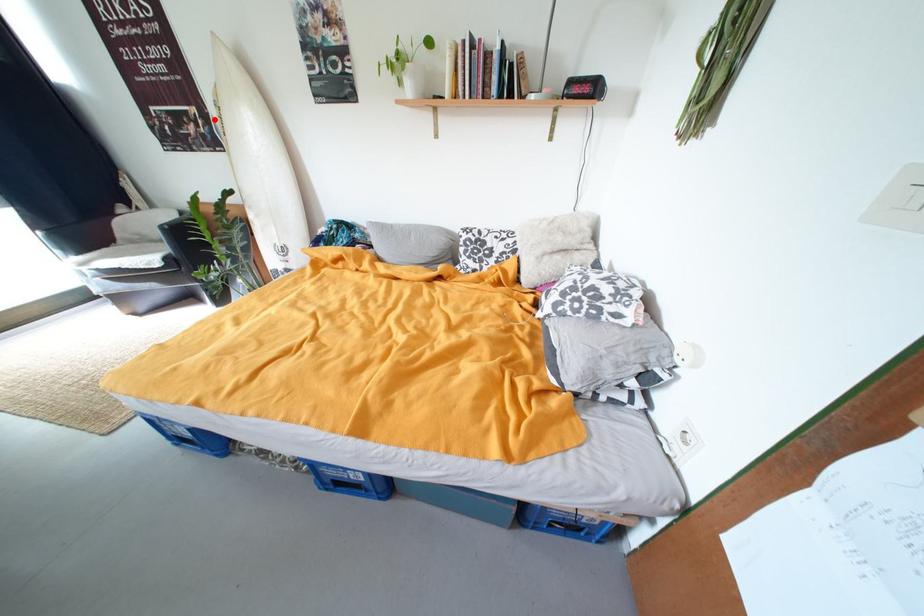
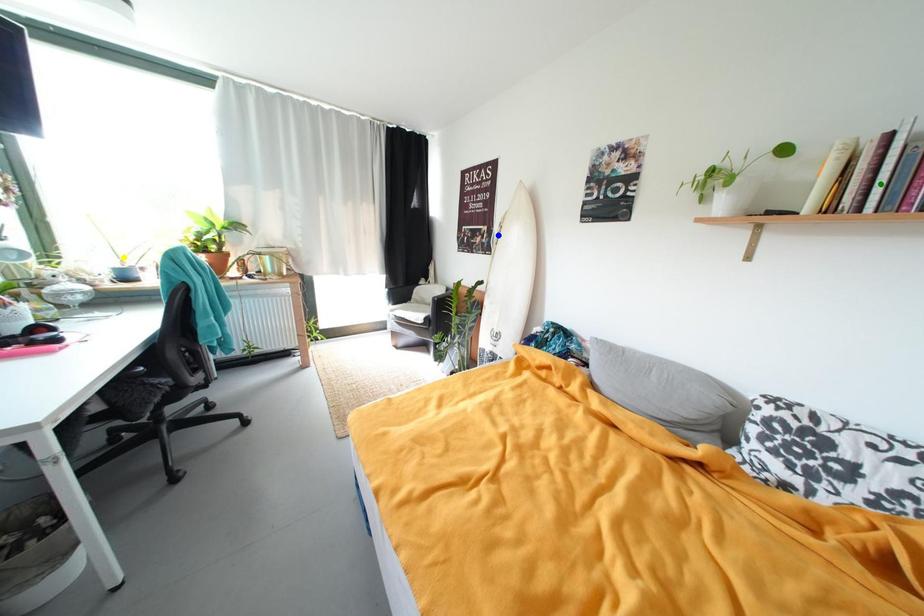
Question: I am providing you with two images of the same scene from different viewpoints. A red point is marked on the first image. You are given multiple points on the second image. Which point in image 2 represents the same 3d spot as the red point in image 1?

Choices:
 (A) green point
 (B) blue point
 (C) yellow point

Answer: (B)